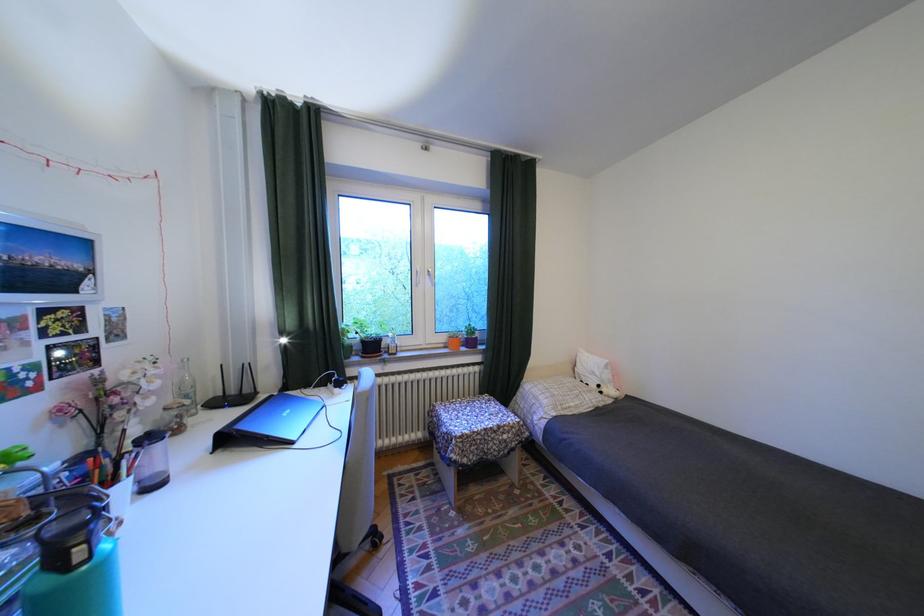
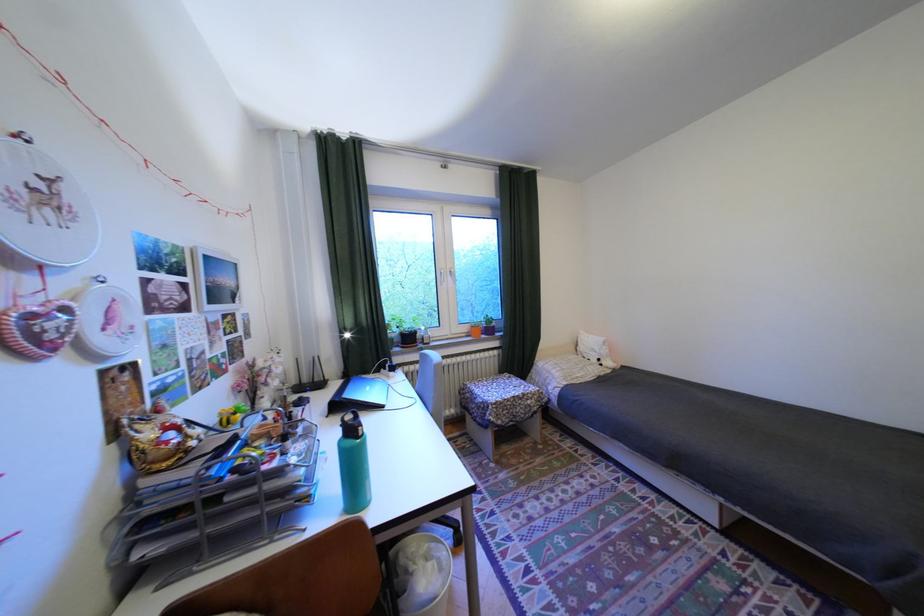
Question: The first image is from the beginning of the video and the second image is from the end. How did the camera likely rotate when shooting the video?

Choices:
 (A) Left
 (B) Right
 (C) Up
 (D) Down

Answer: (B)